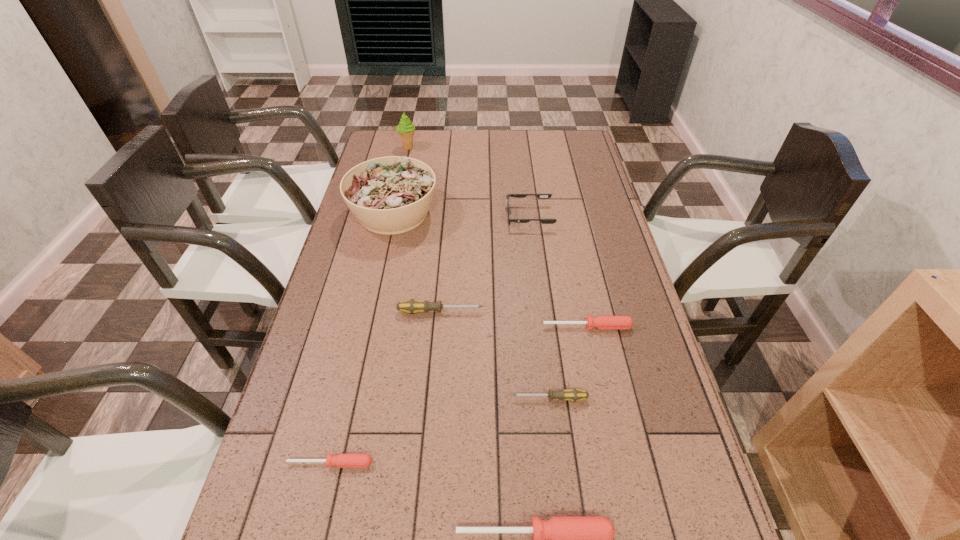
You are a GUI agent. You are given a task and a screenshot of the screen. Output one action in this format:
    pyautogui.click(x=<x>, y=<y>)
    Task: Click on the vacant position located 0.320m at the tip of the right gray screwdriver
    Image resolution: width=960 pixels, height=540 pixels.
    Given the screenshot: What is the action you would take?
    pyautogui.click(x=377, y=399)

I want to click on vacant region located 0.370m at the tip of the right gray screwdriver, so click(356, 399).

Find the location of a particular element. This screenshot has width=960, height=540. vacant area situated on the front of the shortest object is located at coordinates (316, 526).

Where is `object that is at the far edge`? This screenshot has height=540, width=960. object that is at the far edge is located at coordinates (406, 129).

Locate an element on the screen. The width and height of the screenshot is (960, 540). icecream at the left edge is located at coordinates (406, 129).

Find the location of a particular element. This screenshot has width=960, height=540. salad that is at the left edge is located at coordinates (391, 195).

The image size is (960, 540). I want to click on screwdriver that is positioned at the left edge, so point(341,460).

Where is `object at the right edge`? Image resolution: width=960 pixels, height=540 pixels. object at the right edge is located at coordinates (601, 322).

This screenshot has width=960, height=540. In order to click on object located in the far left corner section of the desktop in this screenshot , I will do `click(406, 129)`.

The width and height of the screenshot is (960, 540). I want to click on vacant position at the far edge of the desktop, so click(x=530, y=142).